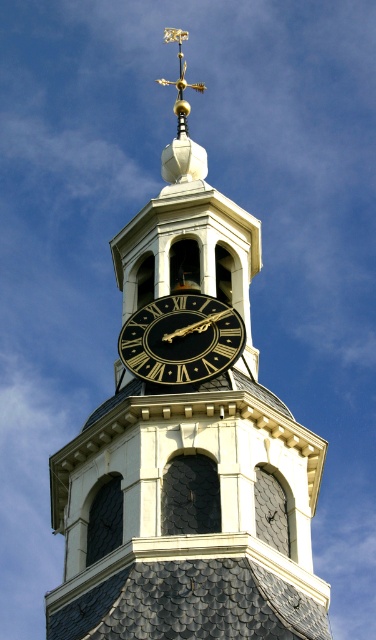
Question: Is black clock tower at center bigger than black polished clock at center?

Choices:
 (A) no
 (B) yes

Answer: (B)

Question: Can you confirm if black clock tower at center is positioned to the right of black polished clock at center?

Choices:
 (A) yes
 (B) no

Answer: (B)

Question: Does black clock tower at center have a greater width compared to black polished clock at center?

Choices:
 (A) yes
 (B) no

Answer: (A)

Question: Which point is closer to the camera taking this photo?

Choices:
 (A) (101, 557)
 (B) (189, 369)

Answer: (A)

Question: Which point is closer to the camera taking this photo?

Choices:
 (A) (156, 317)
 (B) (172, 547)

Answer: (B)